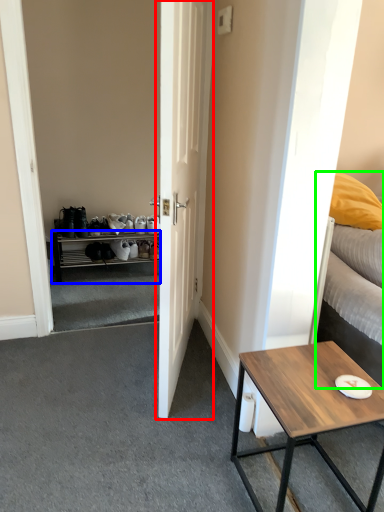
Question: Estimate the real-world distances between objects in this image. Which object is closer to door (highlighted by a red box), cabinetry (highlighted by a blue box) or bed (highlighted by a green box)?

Choices:
 (A) cabinetry
 (B) bed

Answer: (B)